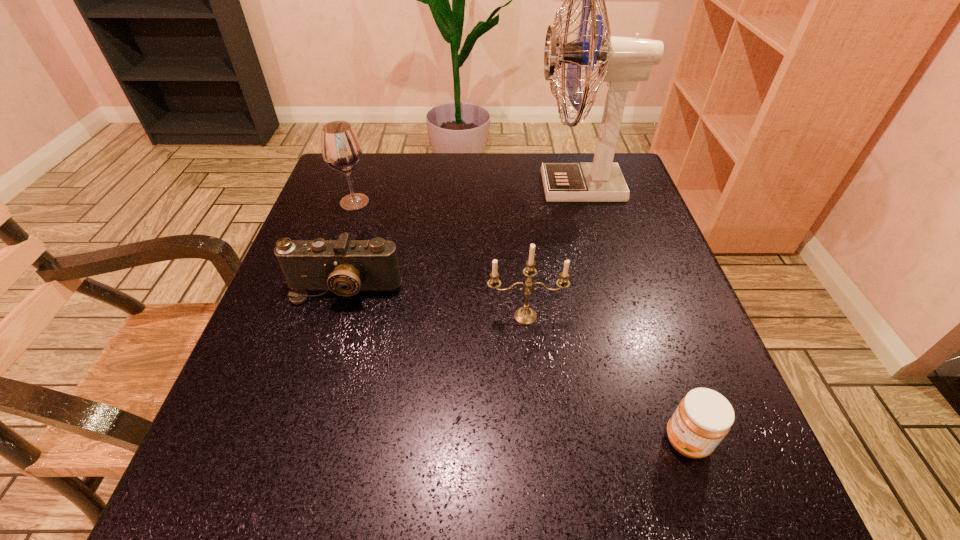
You are a GUI agent. You are given a task and a screenshot of the screen. Output one action in this format:
    pyautogui.click(x=<x>, y=<y>)
    Task: Click on the vacant region located 0.070m on the front-facing side of the camera
    
    Given the screenshot: What is the action you would take?
    pyautogui.click(x=329, y=335)

Locate an element on the screen. Image resolution: width=960 pixels, height=540 pixels. free space located 0.110m on the front label of the jam is located at coordinates [590, 441].

Locate an element on the screen. The width and height of the screenshot is (960, 540). free space located on the front label of the jam is located at coordinates (417, 441).

In order to click on vacant area located 0.230m on the front label of the jam in this screenshot , I will do `click(511, 441)`.

Where is `fan that is at the far edge`? This screenshot has height=540, width=960. fan that is at the far edge is located at coordinates (623, 61).

Where is `wineglass located at the far edge`? This screenshot has width=960, height=540. wineglass located at the far edge is located at coordinates (341, 149).

Find the location of `object that is at the near edge`. object that is at the near edge is located at coordinates (704, 417).

At what (x,y) coordinates should I click in order to perform the action: click on wineglass present at the left edge. Please return your answer as a coordinate pair (x, y). The height and width of the screenshot is (540, 960). Looking at the image, I should click on (341, 149).

Where is `camera that is positioned at the left edge`? The height and width of the screenshot is (540, 960). camera that is positioned at the left edge is located at coordinates (345, 267).

Where is `fan present at the right edge`? This screenshot has height=540, width=960. fan present at the right edge is located at coordinates (623, 61).